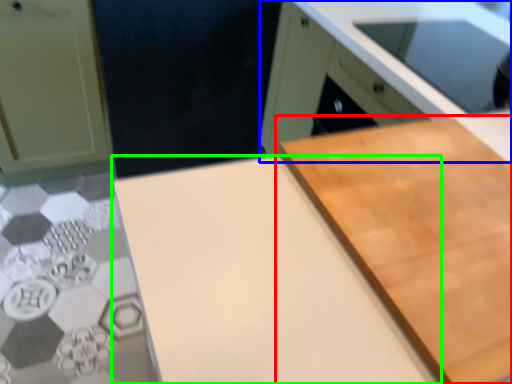
Question: Considering the real-world distances, which object is closest to cutting board (highlighted by a red box)? cabinetry (highlighted by a blue box) or counter top (highlighted by a green box).

Choices:
 (A) cabinetry
 (B) counter top

Answer: (B)